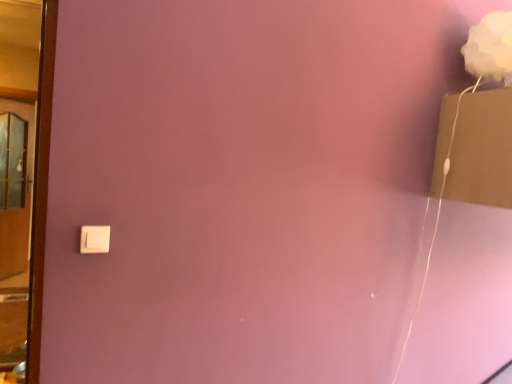
Question: Considering the relative positions of white plastic light switch at lower left and wooden door at left in the image provided, is white plastic light switch at lower left to the right of wooden door at left from the viewer's perspective?

Choices:
 (A) no
 (B) yes

Answer: (B)

Question: Considering the relative sizes of white plastic light switch at lower left and wooden door at left in the image provided, is white plastic light switch at lower left shorter than wooden door at left?

Choices:
 (A) yes
 (B) no

Answer: (A)

Question: Is white plastic light switch at lower left at the left side of wooden door at left?

Choices:
 (A) yes
 (B) no

Answer: (B)

Question: Is white plastic light switch at lower left outside of wooden door at left?

Choices:
 (A) yes
 (B) no

Answer: (A)

Question: Can you see white plastic light switch at lower left touching wooden door at left?

Choices:
 (A) yes
 (B) no

Answer: (B)

Question: Choose the correct answer: Is white plastic light switch at lower left inside wooden door at left or outside it?

Choices:
 (A) outside
 (B) inside

Answer: (A)

Question: In terms of width, does white plastic light switch at lower left look wider or thinner when compared to wooden door at left?

Choices:
 (A) wide
 (B) thin

Answer: (B)

Question: From the image's perspective, is white plastic light switch at lower left positioned above or below wooden door at left?

Choices:
 (A) below
 (B) above

Answer: (A)

Question: From a real-world perspective, is white plastic light switch at lower left above or below wooden door at left?

Choices:
 (A) below
 (B) above

Answer: (A)

Question: Would you say wooden door at left is inside or outside white plastic light switch at lower left?

Choices:
 (A) outside
 (B) inside

Answer: (A)

Question: From the image's perspective, is wooden door at left located above or below white plastic light switch at lower left?

Choices:
 (A) below
 (B) above

Answer: (B)

Question: Is wooden door at left to the left or to the right of white plastic light switch at lower left in the image?

Choices:
 (A) right
 (B) left

Answer: (B)

Question: In terms of size, does wooden door at left appear bigger or smaller than white plastic light switch at lower left?

Choices:
 (A) big
 (B) small

Answer: (A)

Question: Choose the correct answer: Is white matte flower at upper right inside white plastic light switch at lower left or outside it?

Choices:
 (A) inside
 (B) outside

Answer: (B)

Question: Is point (485, 39) positioned closer to the camera than point (99, 240)?

Choices:
 (A) farther
 (B) closer

Answer: (A)